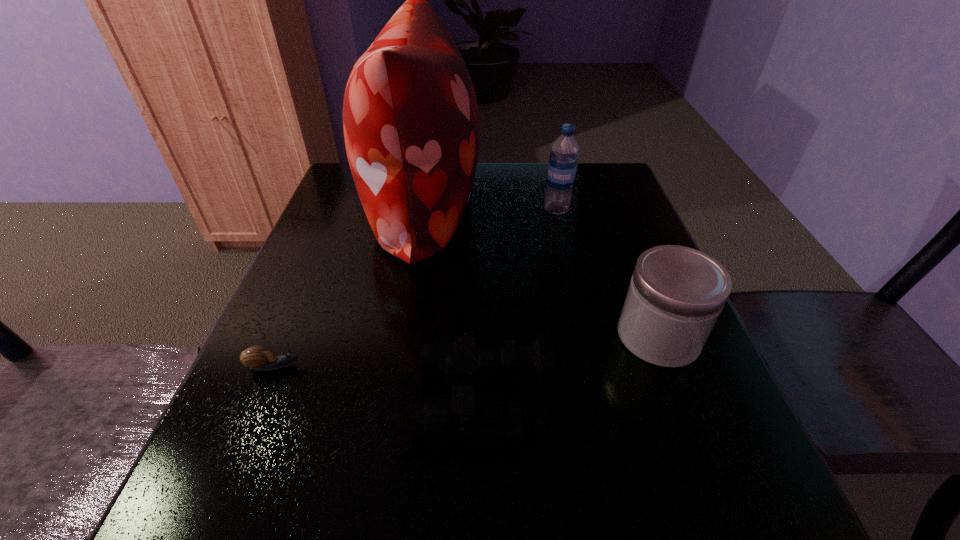
You are a GUI agent. You are given a task and a screenshot of the screen. Output one action in this format:
    pyautogui.click(x=<x>, y=<y>)
    Task: Click on the cushion
    
    Given the screenshot: What is the action you would take?
    pyautogui.click(x=410, y=118)

The image size is (960, 540). In order to click on water bottle in this screenshot , I will do `click(563, 160)`.

Identify the location of the fourth object from left to right. [x=563, y=160].

Locate an element on the screen. Image resolution: width=960 pixels, height=540 pixels. the rightmost object is located at coordinates (676, 294).

This screenshot has width=960, height=540. In order to click on the third shortest object in this screenshot , I will do `click(676, 294)`.

Where is `binoculars`? Image resolution: width=960 pixels, height=540 pixels. binoculars is located at coordinates (467, 358).

You are a GUI agent. You are given a task and a screenshot of the screen. Output one action in this format:
    pyautogui.click(x=<x>, y=<y>)
    Task: Click on the escargot
    The height and width of the screenshot is (540, 960).
    Given the screenshot: What is the action you would take?
    pyautogui.click(x=257, y=358)

You are a GUI agent. You are given a task and a screenshot of the screen. Output one action in this format:
    pyautogui.click(x=<x>, y=<y>)
    Task: Click on the leftmost object
    
    Given the screenshot: What is the action you would take?
    pyautogui.click(x=257, y=358)

Find the location of a particular element. This screenshot has height=540, width=960. free space located on the front-facing side of the cushion is located at coordinates (613, 208).

You are a GUI agent. You are given a task and a screenshot of the screen. Output one action in this format:
    pyautogui.click(x=<x>, y=<y>)
    Task: Click on the free space located on the label of the water bottle
    The image size is (960, 540).
    Given the screenshot: What is the action you would take?
    pyautogui.click(x=496, y=210)